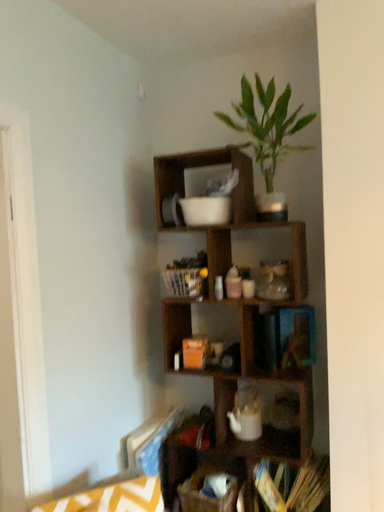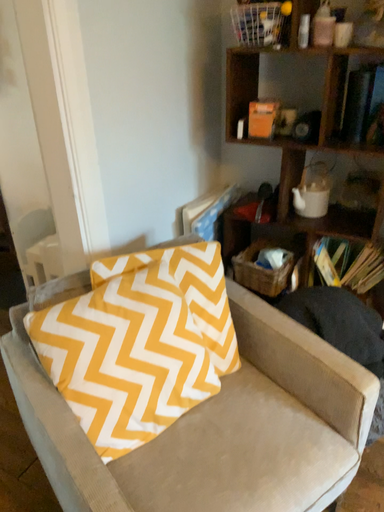
Question: How did the camera likely rotate when shooting the video?

Choices:
 (A) rotated upward
 (B) rotated downward

Answer: (B)